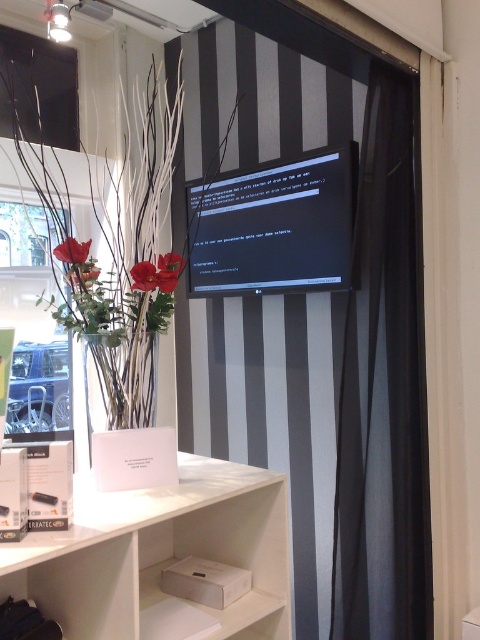
Is point (256, 336) closer to viewer compared to point (179, 256)?

No, (256, 336) is behind (179, 256).

Does black matte curtain at upper center come in front of red matte flower at center?

That is True.

Who is more distant from viewer, (226, 406) or (180, 264)?

Positioned behind is point (226, 406).

Locate an element on the screen. The height and width of the screenshot is (640, 480). black matte curtain at upper center is located at coordinates (314, 321).

Find the location of a particular element. The image size is (480, 640). black glossy monitor at upper center is located at coordinates (274, 227).

Does point (245, 243) lie behind point (60, 246)?

Yes, it is.

You are a GUI agent. You are given a task and a screenshot of the screen. Output one action in this format:
    pyautogui.click(x=<x>, y=<y>)
    Task: Click on the black glossy monitor at upper center
    
    Given the screenshot: What is the action you would take?
    pyautogui.click(x=274, y=227)

Which is above, white matte bookshelf at lower center or matte red flower at center?

matte red flower at center

Who is more forward, [197,522] or [67,250]?

Point [67,250] is in front.

Where is `white matte bookshelf at lower center`? The width and height of the screenshot is (480, 640). white matte bookshelf at lower center is located at coordinates (159, 552).